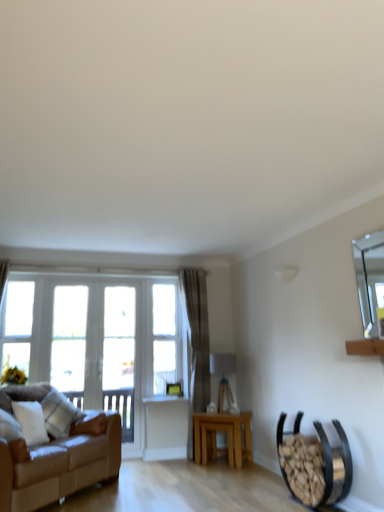
Identify the location of free location in front of light brown wooden table at center. (226, 471).